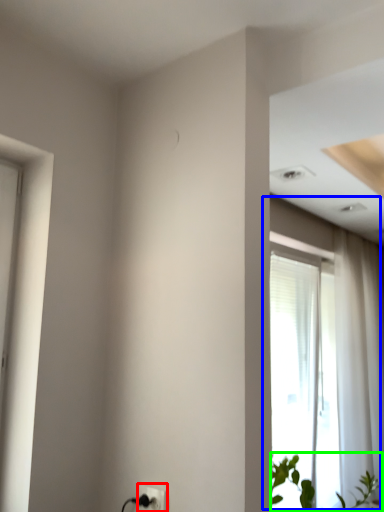
Question: Considering the real-world distances, which object is closest to electric outlet (highlighted by a red box)? window (highlighted by a blue box) or houseplant (highlighted by a green box).

Choices:
 (A) window
 (B) houseplant

Answer: (B)